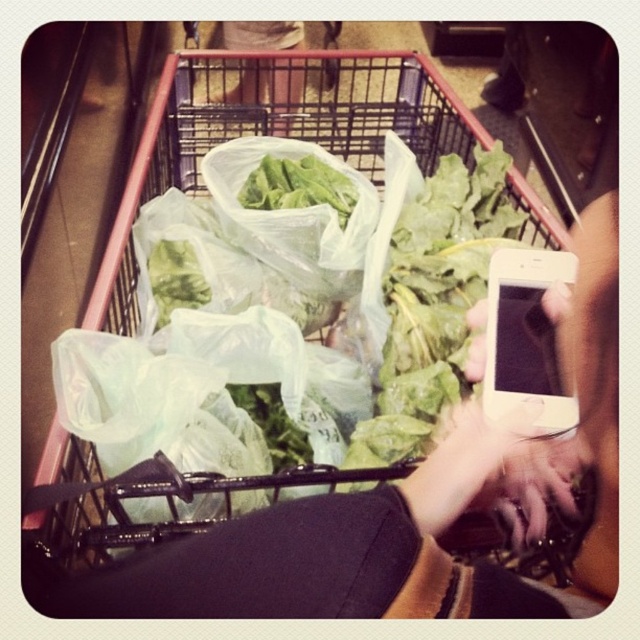
Question: In this image, where is matte plastic pants at center located relative to green leafy lettuce at center?

Choices:
 (A) left
 (B) right

Answer: (A)

Question: Which point is farther to the camera?

Choices:
 (A) (284, 115)
 (B) (156, 538)
 (C) (301, 179)

Answer: (A)

Question: Which point is farther to the camera?

Choices:
 (A) (266, 170)
 (B) (376, 132)
 (C) (243, 60)

Answer: (C)

Question: Can you confirm if matte plastic pants at center is bigger than green leafy lettuce at center?

Choices:
 (A) no
 (B) yes

Answer: (B)

Question: Which point appears farthest from the camera in this image?

Choices:
 (A) (262, 172)
 (B) (342, 52)
 (C) (269, 33)

Answer: (C)

Question: Does clear plastic shopping cart at center appear on the left side of matte plastic pants at center?

Choices:
 (A) yes
 (B) no

Answer: (B)